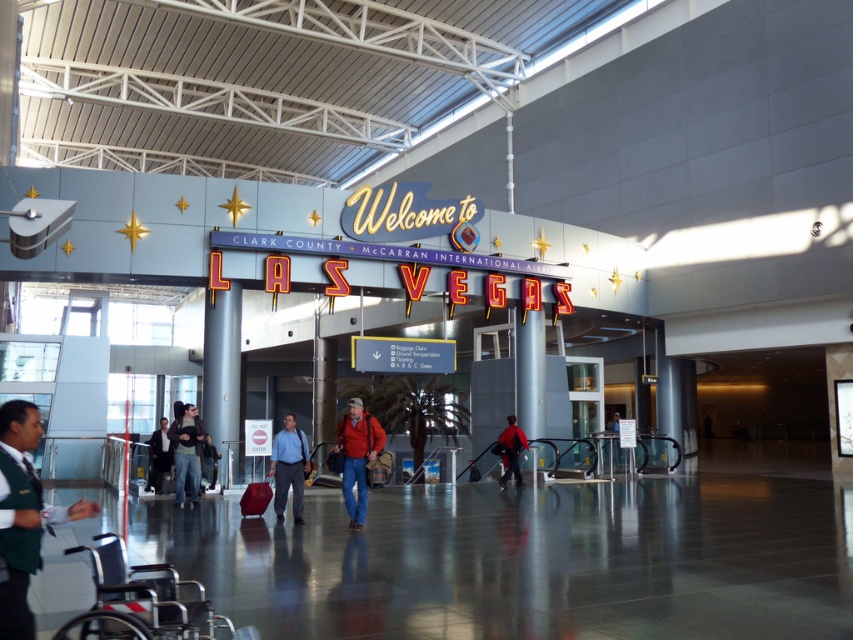
Consider the image. Can you confirm if blue shirt at center is bigger than denim jacket at center?

Actually, blue shirt at center might be smaller than denim jacket at center.

Can you confirm if blue shirt at center is shorter than denim jacket at center?

Yes.

Measure the distance between point (282,451) and camera.

Point (282,451) is 11.98 meters away from camera.

In order to click on blue shirt at center in this screenshot , I will do `click(288, 467)`.

Who is shorter, red matte jacket at center or dark blue jacket at center?

With less height is dark blue jacket at center.

Who is more forward, (341, 452) or (160, 454)?

Point (341, 452)

Is point (363, 420) behind point (149, 464)?

That is False.

The width and height of the screenshot is (853, 640). I want to click on red matte jacket at center, so click(357, 456).

Does point (189, 404) come farther from viewer compared to point (503, 468)?

That is False.

Is jeans at center smaller than red fabric jacket at center?

Incorrect, jeans at center is not smaller in size than red fabric jacket at center.

Who is more forward, (183, 426) or (508, 422)?

Positioned in front is point (183, 426).

In order to click on jeans at center in this screenshot , I will do `click(187, 451)`.